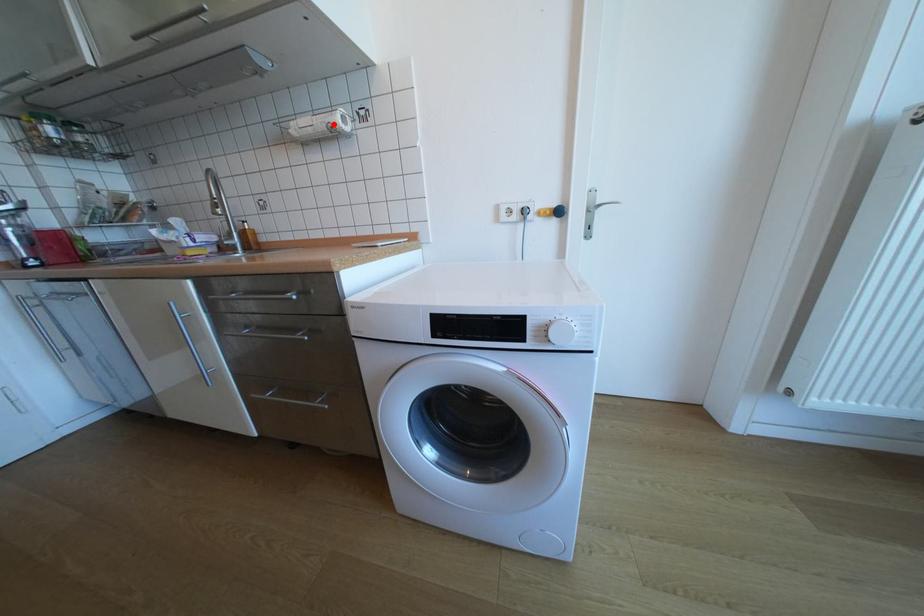
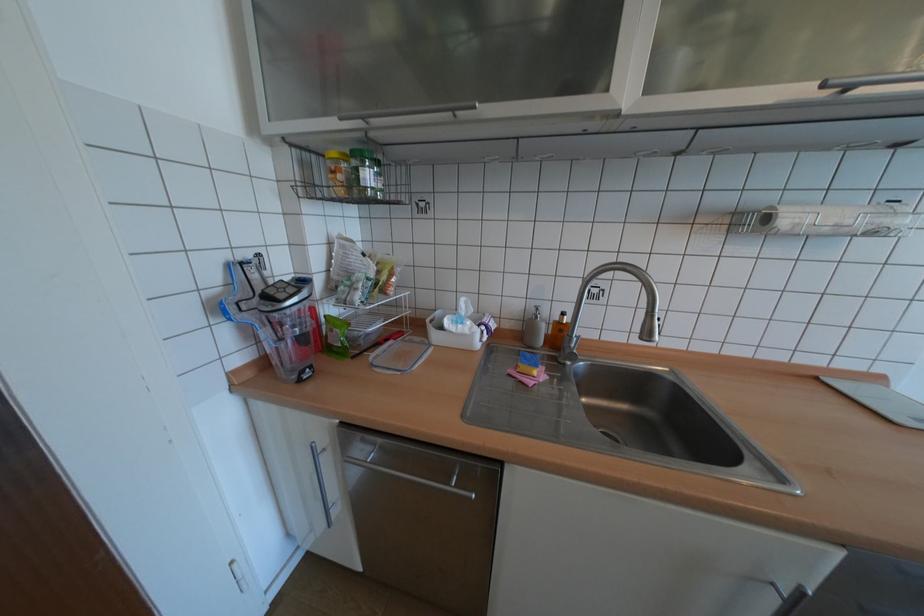
Where in the second image is the point corresponding to the highlighted location from the first image?

(881, 227)